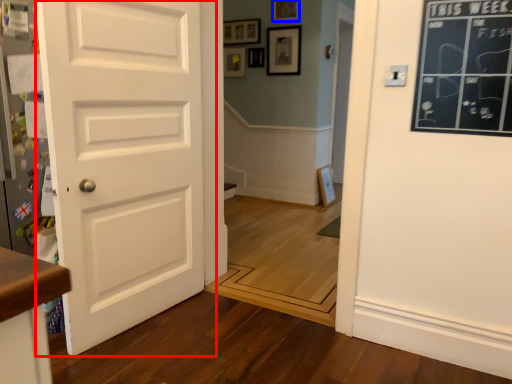
Question: Which point is closer to the camera, door (highlighted by a red box) or picture frame (highlighted by a blue box)?

Choices:
 (A) door
 (B) picture frame

Answer: (A)